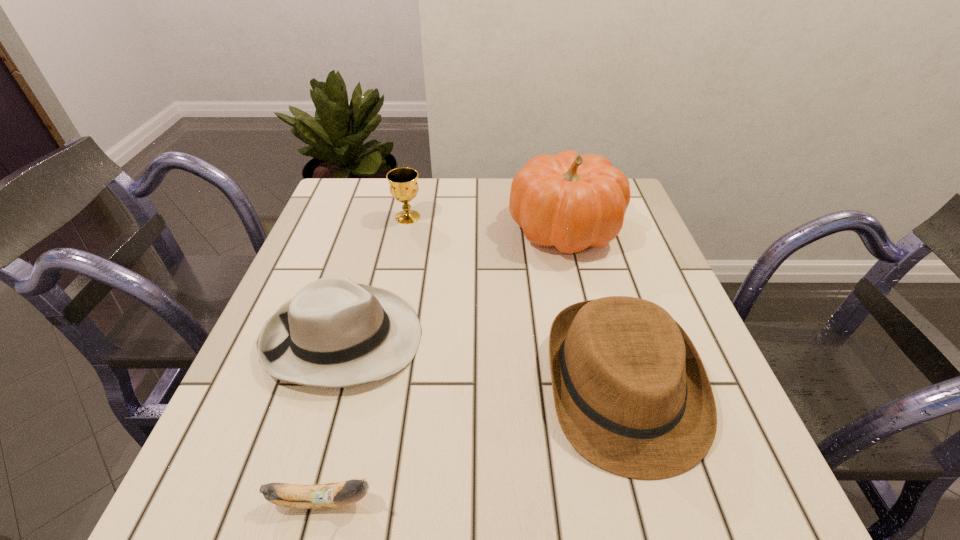
Locate an element on the screen. Image resolution: width=960 pixels, height=540 pixels. object situated at the near right corner is located at coordinates (632, 396).

Identify the location of free spot at the far edge of the desktop. The width and height of the screenshot is (960, 540). (462, 207).

This screenshot has height=540, width=960. Find the location of `free space at the near edge`. free space at the near edge is located at coordinates (534, 476).

Locate an element on the screen. free space at the left edge of the desktop is located at coordinates (237, 415).

In the image, there is a desktop. Identify the location of vacant space at the right edge. (635, 265).

What are the coordinates of `vacant region at the near left corner of the desktop` in the screenshot? It's located at (216, 481).

At what (x,y) coordinates should I click in order to perform the action: click on vacant space that is in between the nearest object and the left fedora. Please return your answer as a coordinate pair (x, y). Image resolution: width=960 pixels, height=540 pixels. Looking at the image, I should click on (333, 420).

Locate an element on the screen. vacant area that lies between the pumpkin and the chalice is located at coordinates (486, 222).

At what (x,y) coordinates should I click in order to perform the action: click on unoccupied area between the right fedora and the left fedora. Please return your answer as a coordinate pair (x, y). Looking at the image, I should click on (483, 363).

Locate an element on the screen. This screenshot has height=540, width=960. free spot between the right fedora and the left fedora is located at coordinates (x=483, y=363).